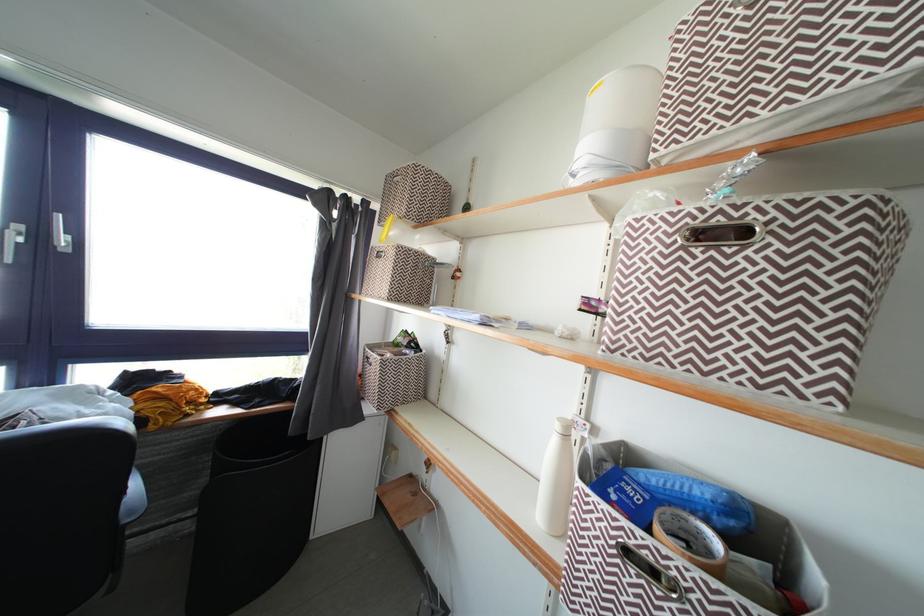
Which object does [690,540] point to?

It refers to a roll of tape.